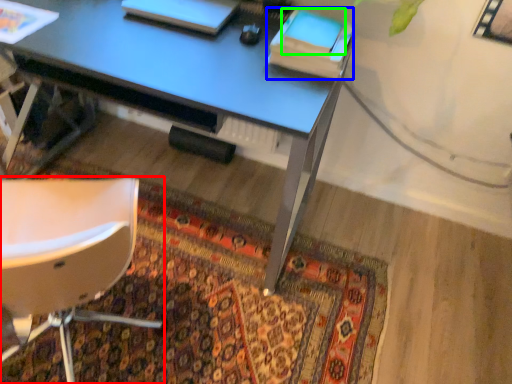
Question: Estimate the real-world distances between objects in this image. Which object is farther from chair (highlighted by a red box), book (highlighted by a blue box) or notepad (highlighted by a green box)?

Choices:
 (A) book
 (B) notepad

Answer: (B)